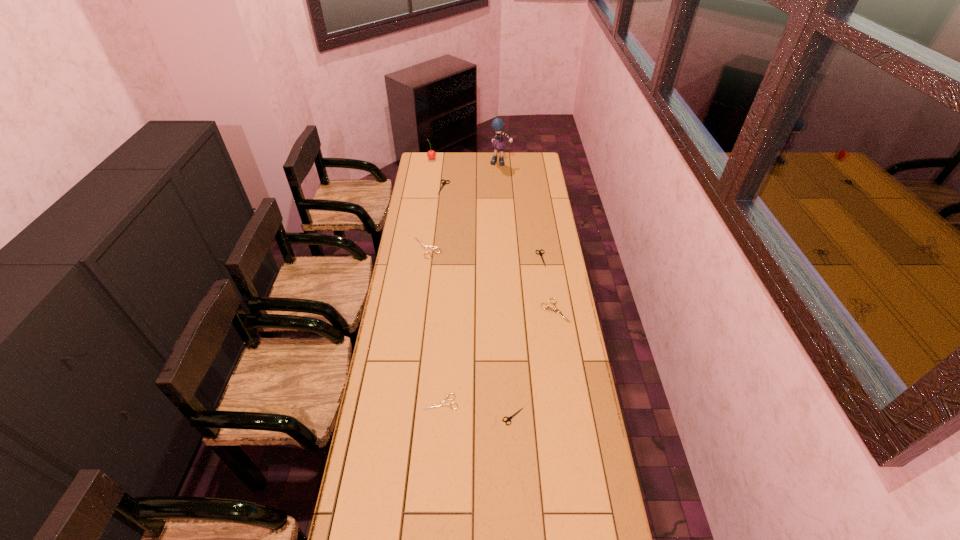
You are a GUI agent. You are given a task and a screenshot of the screen. Output one action in this format:
    pyautogui.click(x=<x>, y=<y>)
    Task: Click on the vacant area between the farthest shears and the biggest beige shears
    
    Given the screenshot: What is the action you would take?
    pyautogui.click(x=436, y=218)

Where is `empty space between the biggest beige shears and the rightmost beige shears`? The height and width of the screenshot is (540, 960). empty space between the biggest beige shears and the rightmost beige shears is located at coordinates (491, 279).

Identify the location of vacant space that's between the second tallest object and the nearest black shears. The image size is (960, 540). (472, 287).

The image size is (960, 540). I want to click on empty location between the nearest beige shears and the tallest object, so click(x=470, y=282).

I want to click on free space between the blue rag doll and the cherry, so click(x=467, y=160).

Identify the location of empty location between the cherry and the tallest object. (467, 160).

Select which object is the sixth closest to the second farthest beige shears. Please provide its 2D coordinates. Your answer should be formatted as a tuple, i.e. [(x, y)], where the tuple contains the x and y coordinates of a point satisfying the conditions above.

[(497, 124)]

The height and width of the screenshot is (540, 960). Find the location of `the seventh closest object to the cherry`. the seventh closest object to the cherry is located at coordinates (508, 418).

Identify the location of the fifth closest shears relative to the farthest shears. The image size is (960, 540). (508, 418).

The height and width of the screenshot is (540, 960). In order to click on the third closest shears to the cherry in this screenshot , I will do `click(540, 253)`.